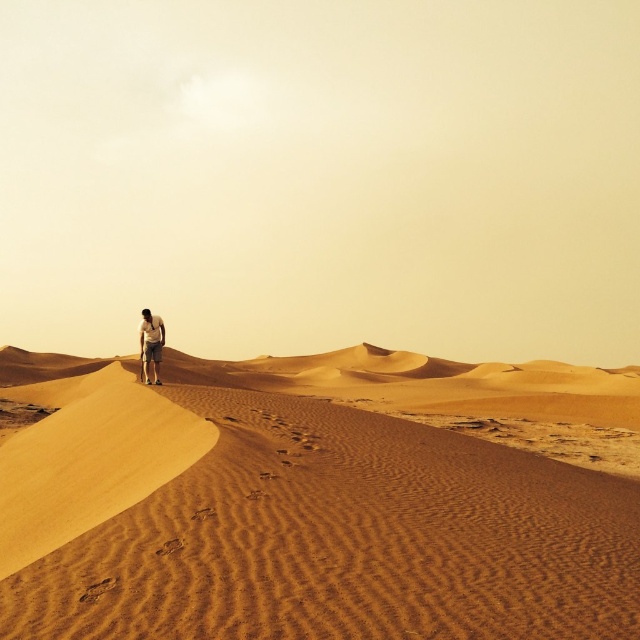
How far apart are sandy textured dunes at center and light brown sand at center?

sandy textured dunes at center and light brown sand at center are 14.13 meters apart.

Find the location of a particular element. The height and width of the screenshot is (640, 640). sandy textured dunes at center is located at coordinates (308, 500).